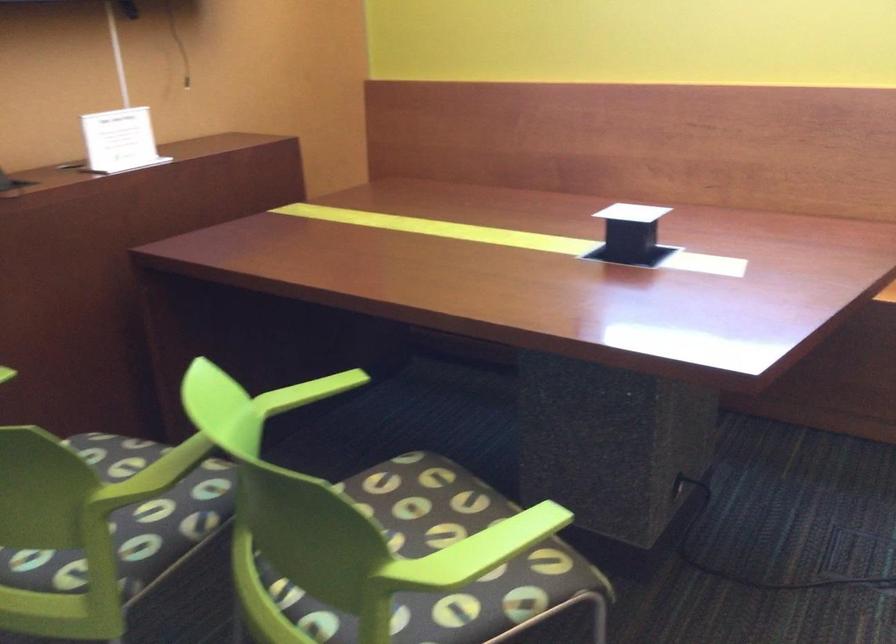
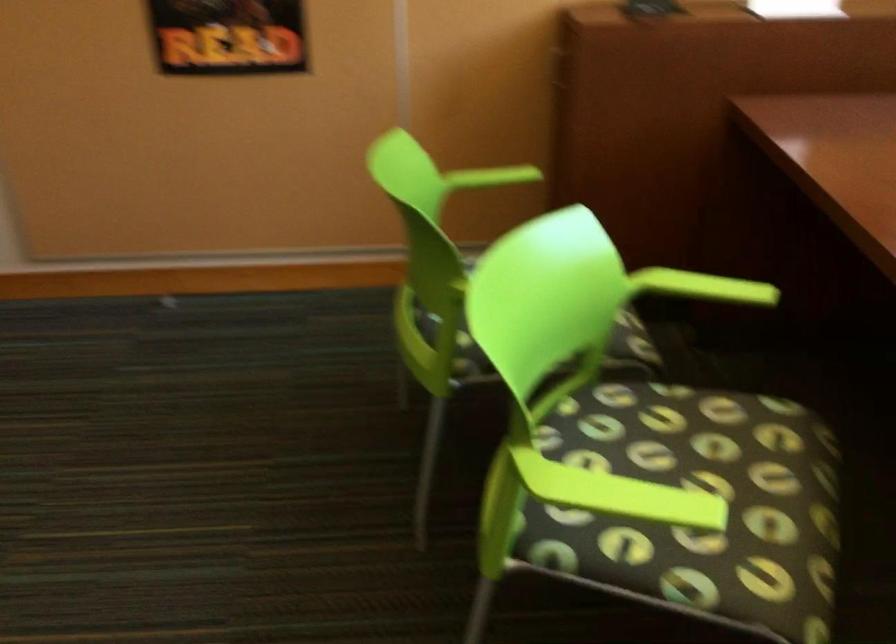
In the second image, find the point that corresponds to [490,536] in the first image.

(619, 494)